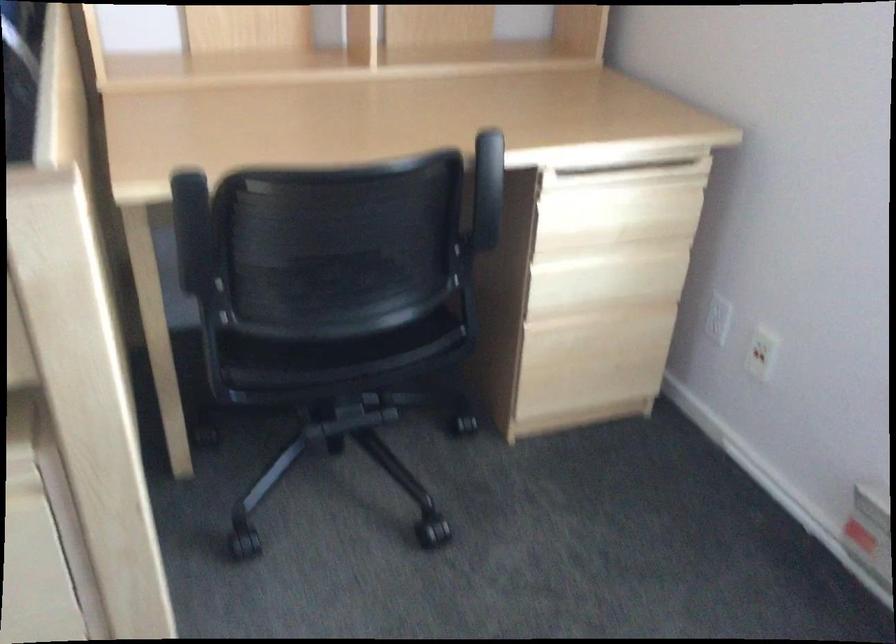
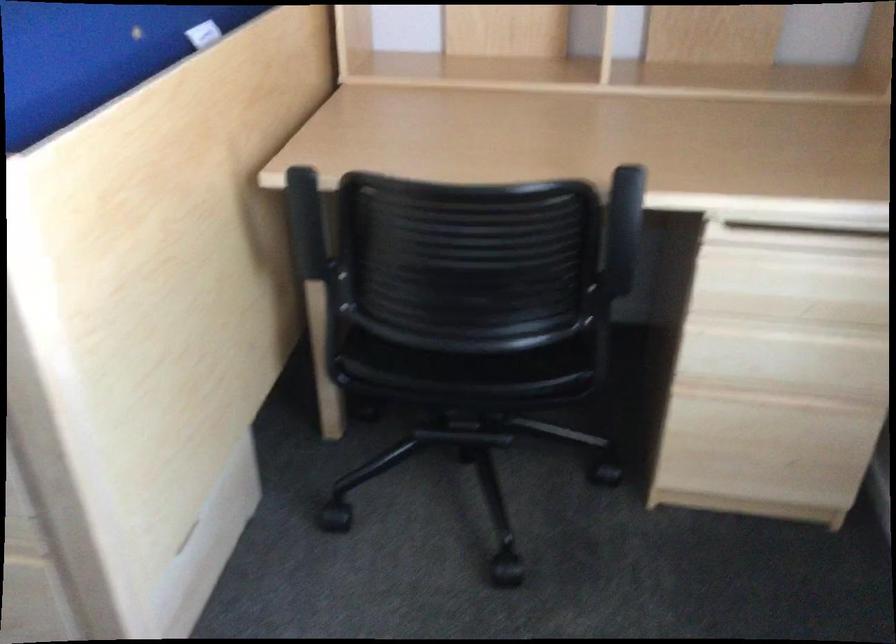
Question: The first image is from the beginning of the video and the second image is from the end. How did the camera likely rotate when shooting the video?

Choices:
 (A) Left
 (B) Right
 (C) Up
 (D) Down

Answer: (A)